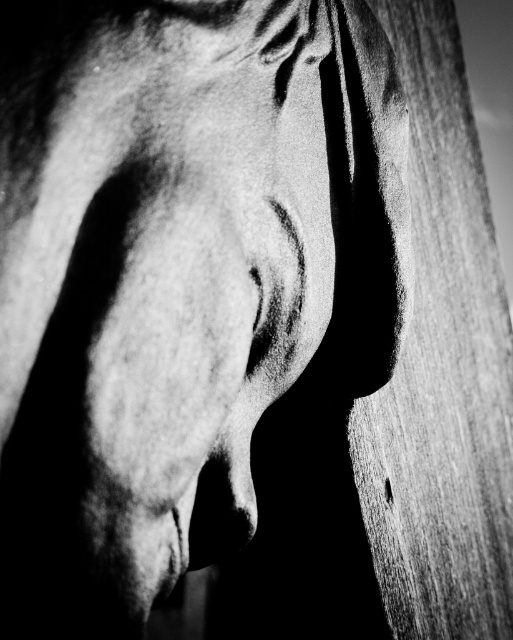
You are an artist sketching this horse head. You want to add a highlight on the point that is closer to you. Which point should you choose between point (410, 468) and point (226, 516)?

Point (226, 516) is closer to the viewer than point (410, 468), so you should add the highlight on point (226, 516).

Looking at this image, based on the scene description, where is the wooden plank at right located in the image?

The wooden plank at right is located at point [442,371] in the image.

Based on the scene description, if you were to draw a straight line from the tip of the smooth gray nose at center to the wooden plank at right, would the line pass through the horse? Explain your reasoning.

The wooden plank at right is to the right of the smooth gray nose at center. Since the wooden plank is positioned to the right of the nose, drawing a straight line from the tip of the nose to the plank would not pass through the horse itself but would instead go around its side, as the plank is already on the right side of the nose. Therefore, the line would not intersect the horse.